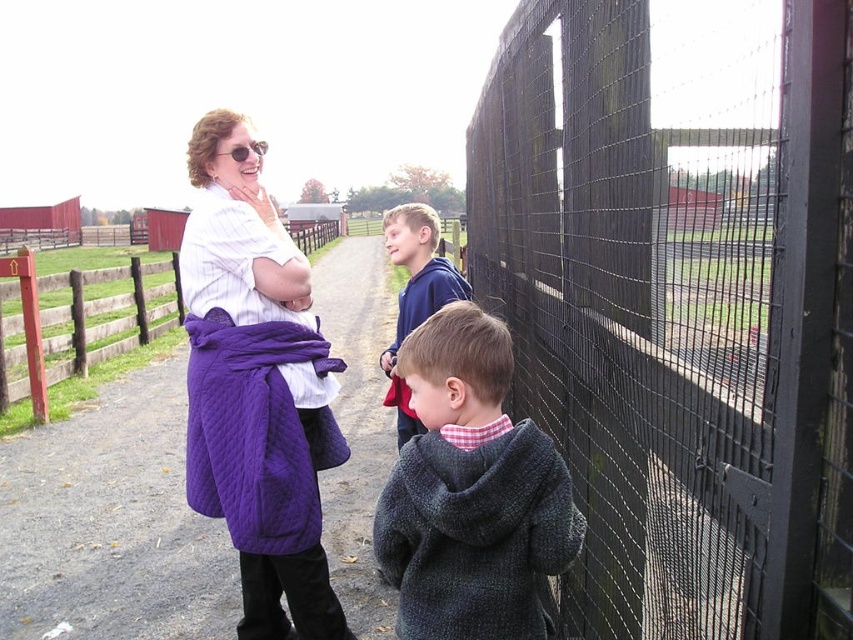
Question: Which object appears farthest from the camera in this image?

Choices:
 (A) blue fleece jacket at center
 (B) dark gray knitted sweater at center

Answer: (A)

Question: Based on their relative distances, which object is nearer to the purple quilted coat at left?

Choices:
 (A) purple quilted coat at center
 (B) blue fleece jacket at center
 (C) dark gray knitted sweater at center

Answer: (A)

Question: Does purple quilted coat at center have a lesser width compared to purple quilted coat at left?

Choices:
 (A) yes
 (B) no

Answer: (A)

Question: In this image, where is dark gray knitted sweater at center located relative to purple quilted coat at left?

Choices:
 (A) below
 (B) above

Answer: (A)

Question: Based on their relative distances, which object is farther from the blue fleece jacket at center?

Choices:
 (A) dark gray knitted sweater at center
 (B) purple quilted coat at center
 (C) purple quilted coat at left

Answer: (C)

Question: Is purple quilted coat at center to the right of blue fleece jacket at center from the viewer's perspective?

Choices:
 (A) no
 (B) yes

Answer: (A)